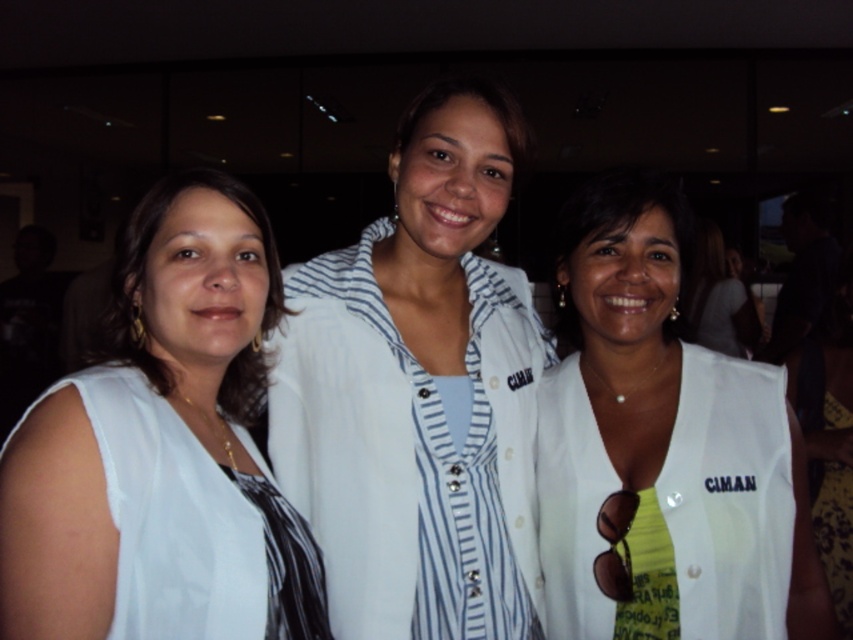
Is point (299, 397) positioned behind point (833, 424)?

No, (299, 397) is closer to viewer.

Which is above, white striped shirt at center or white fabric shirt at center?

Positioned higher is white striped shirt at center.

Where is `white striped shirt at center`? white striped shirt at center is located at coordinates (421, 390).

Which is behind, point (595, 262) or point (41, 422)?

The point (595, 262) is behind.

How distant is white matte vest at center from white fabric at left?

21.00 inches

Is point (762, 448) farther from camera compared to point (99, 620)?

Yes, point (762, 448) is farther from viewer.

Locate an element on the screen. The image size is (853, 640). white matte vest at center is located at coordinates (663, 445).

Is point (469, 374) less distant than point (172, 204)?

No, it is behind (172, 204).

In the scene shown: Does white striped shirt at center have a greater width compared to white fabric at left?

Yes, white striped shirt at center is wider than white fabric at left.

Is point (541, 342) farther from camera compared to point (181, 384)?

That is True.

Where is `white striped shirt at center`? The image size is (853, 640). white striped shirt at center is located at coordinates (421, 390).